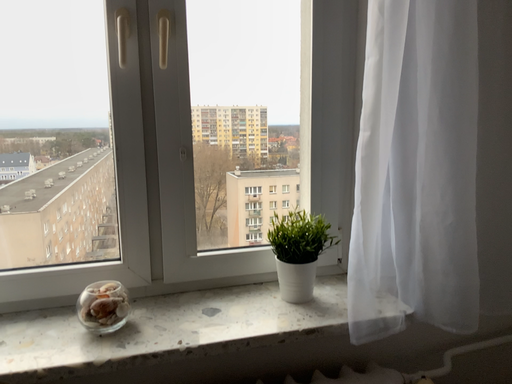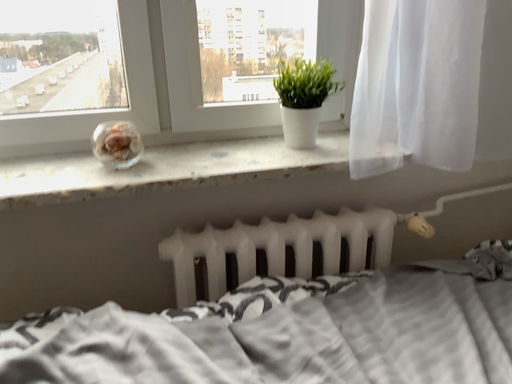
Question: Which way did the camera rotate in the video?

Choices:
 (A) rotated upward
 (B) rotated downward

Answer: (B)